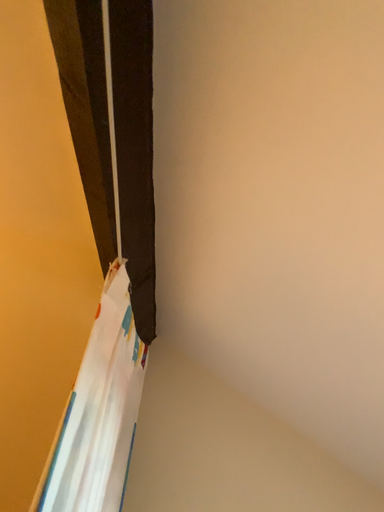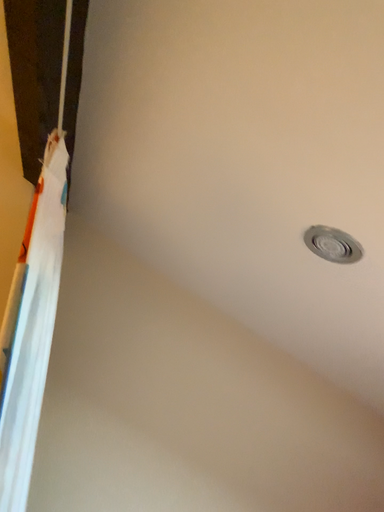
Question: How did the camera likely rotate when shooting the video?

Choices:
 (A) rotated left
 (B) rotated right

Answer: (B)